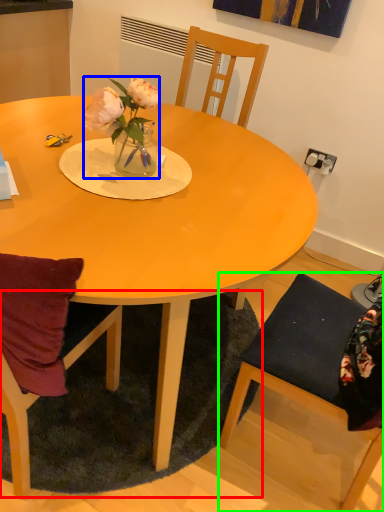
Question: Based on their relative distances, which object is farther from mat (highlighted by a red box)? Choose from houseplant (highlighted by a blue box) and chair (highlighted by a green box).

Choices:
 (A) houseplant
 (B) chair

Answer: (A)